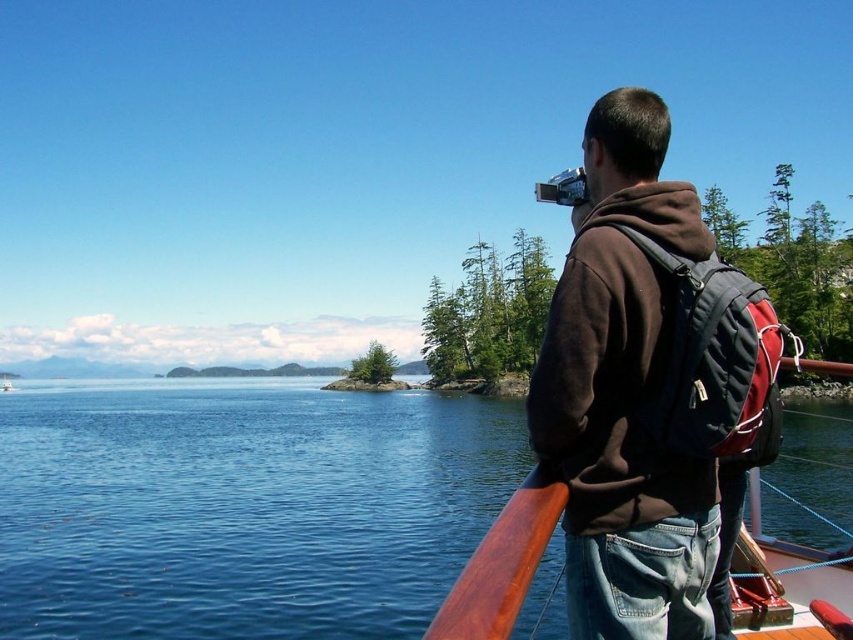
Who is shorter, blue water at center or brown matte hoodie at upper right?

brown matte hoodie at upper right is shorter.

Can you confirm if blue water at center is wider than brown matte hoodie at upper right?

Yes.

Find the location of a particular element. The height and width of the screenshot is (640, 853). blue water at center is located at coordinates (241, 506).